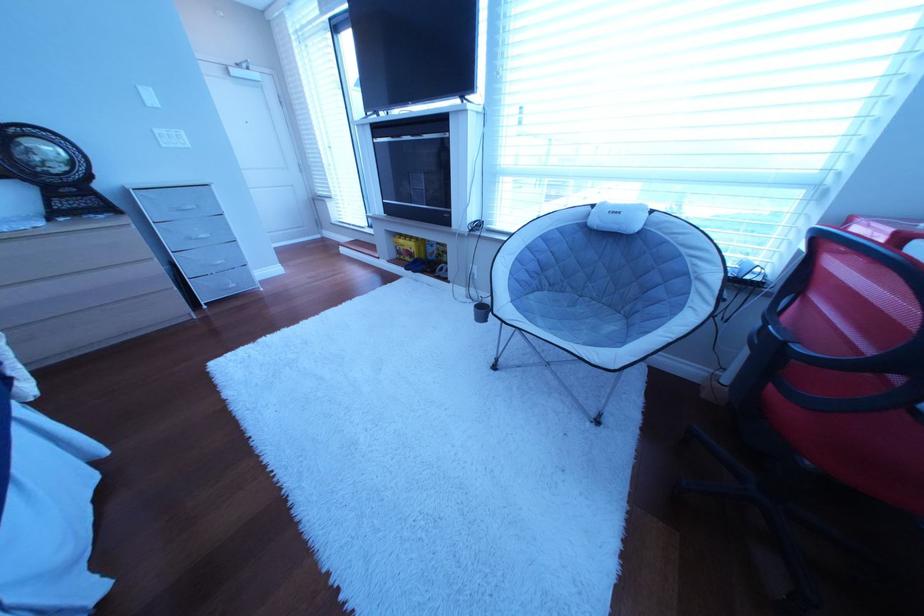
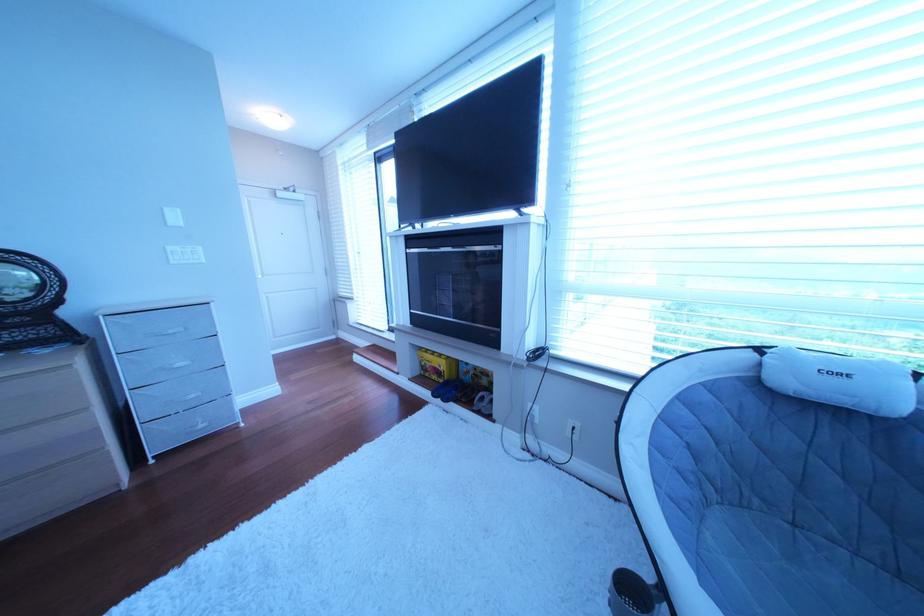
Find the pixel in the second image that matches the point at 152,89 in the first image.

(177, 211)